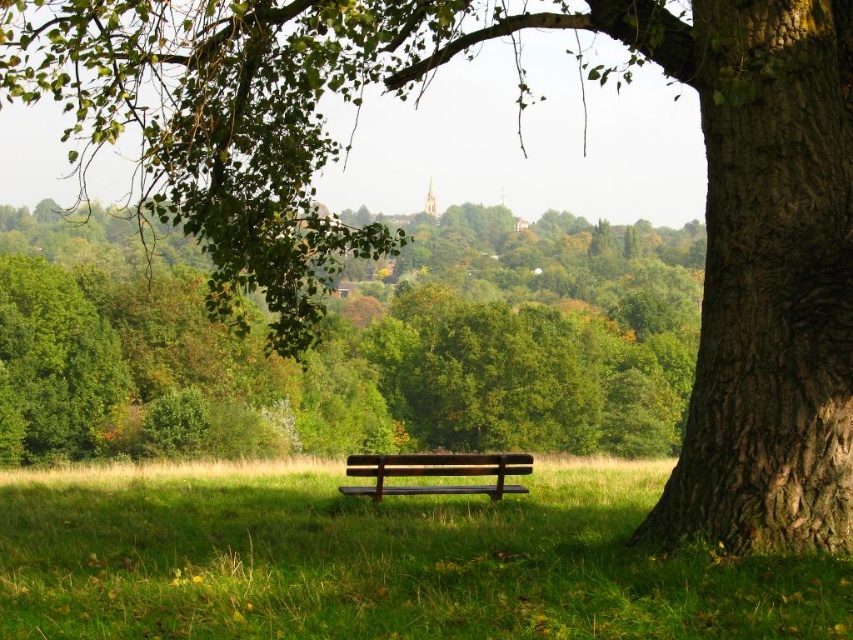
Question: From the image, what is the correct spatial relationship of brown rough bark tree at lower right in relation to green grassy at center?

Choices:
 (A) below
 (B) above

Answer: (B)

Question: Which point is farther from the camera taking this photo?

Choices:
 (A) (621, 444)
 (B) (178, 493)

Answer: (A)

Question: Considering the real-world distances, which object is farthest from the brown wooden bench at center?

Choices:
 (A) brown rough bark tree at lower right
 (B) green grassy at center

Answer: (A)

Question: Observing the image, what is the correct spatial positioning of green grassy at center in reference to brown wooden bench at center?

Choices:
 (A) below
 (B) above

Answer: (B)

Question: Which of the following is the farthest from the observer?

Choices:
 (A) brown rough bark tree at lower right
 (B) green grassy at center
 (C) brown wooden bench at center

Answer: (A)

Question: In this image, where is green grassy at center located relative to brown wooden bench at center?

Choices:
 (A) above
 (B) below

Answer: (A)